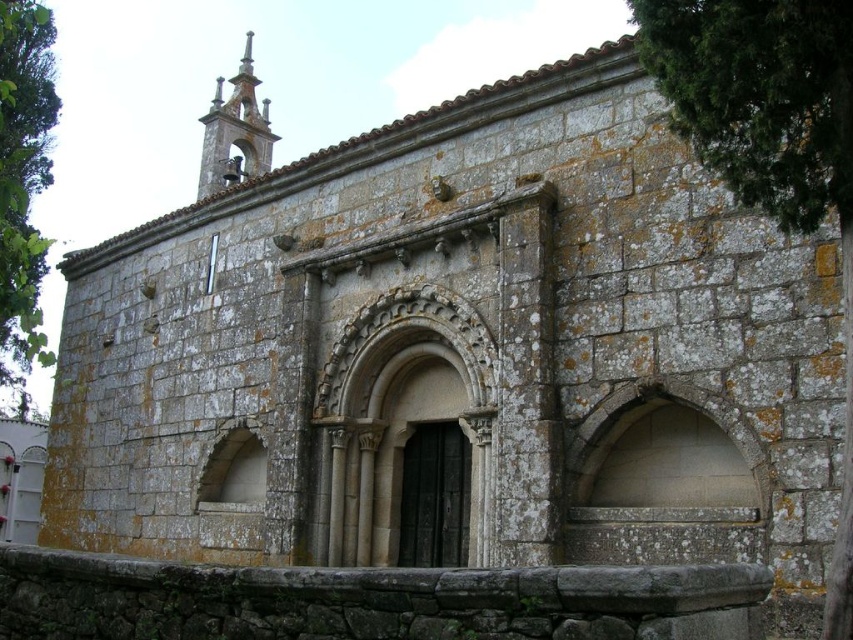
Which is more to the right, green mossy stone wall at upper right or green leafy tree at left?

green mossy stone wall at upper right is more to the right.

I want to click on green mossy stone wall at upper right, so pos(759,97).

This screenshot has width=853, height=640. What do you see at coordinates (759, 97) in the screenshot?
I see `green mossy stone wall at upper right` at bounding box center [759, 97].

Where is `green mossy stone wall at upper right`? The height and width of the screenshot is (640, 853). green mossy stone wall at upper right is located at coordinates (759, 97).